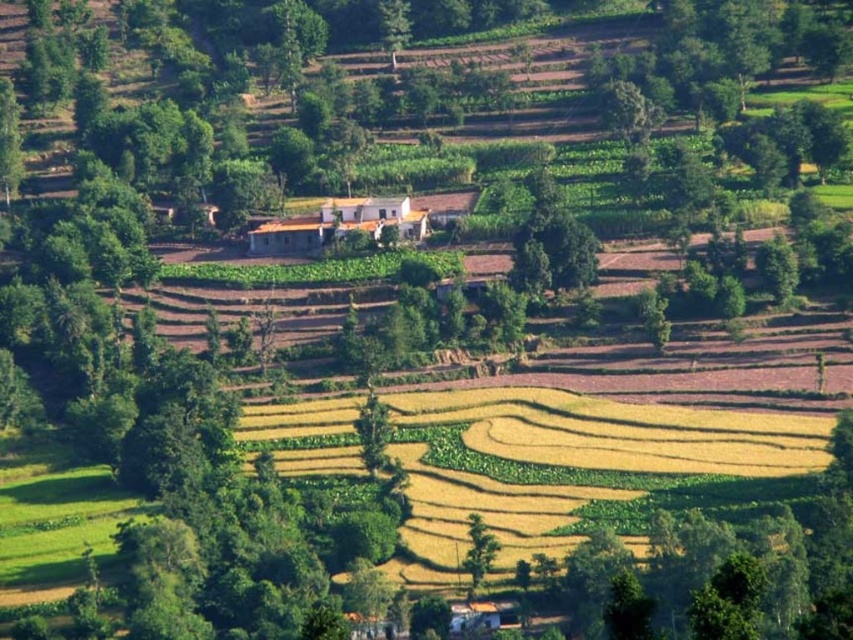
Is point (357, 429) more distant than point (473, 513)?

Yes, it is behind point (473, 513).

Which is more to the right, green leafy tree at center or green leafy tree at lower center?

green leafy tree at lower center

What do you see at coordinates (373, 432) in the screenshot? I see `green leafy tree at center` at bounding box center [373, 432].

You are a GUI agent. You are given a task and a screenshot of the screen. Output one action in this format:
    pyautogui.click(x=<x>, y=<y>)
    Task: Click on the green leafy tree at center
    This screenshot has width=853, height=640.
    Given the screenshot: What is the action you would take?
    pyautogui.click(x=373, y=432)

Is point (492, 403) positioned before point (368, 438)?

That is False.

Is yellow-green grassland at center taller than green leafy tree at center?

Indeed, yellow-green grassland at center has a greater height compared to green leafy tree at center.

In order to click on yellow-green grassland at center in this screenshot , I will do `click(621, 433)`.

Find the location of a particular element. yellow-green grassland at center is located at coordinates (621, 433).

Which is behind, point (433, 474) or point (473, 518)?

The point (433, 474) is behind.

Is yellow-green grassland at center smaller than green leafy tree at lower center?

No, yellow-green grassland at center is not smaller than green leafy tree at lower center.

Which is behind, point (419, 476) or point (474, 576)?

Positioned behind is point (419, 476).

Where is `yellow-green grassland at center`? Image resolution: width=853 pixels, height=640 pixels. yellow-green grassland at center is located at coordinates (621, 433).